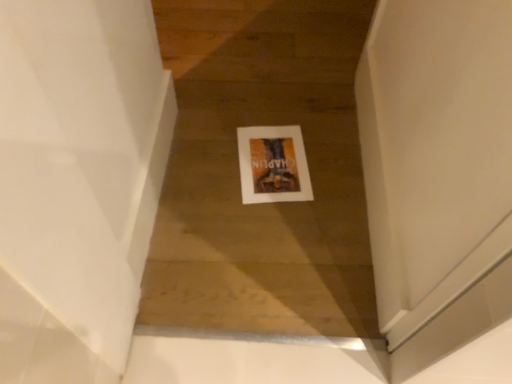
Locate an element on the screen. free spot to the right of white matte picture frame at center is located at coordinates (333, 164).